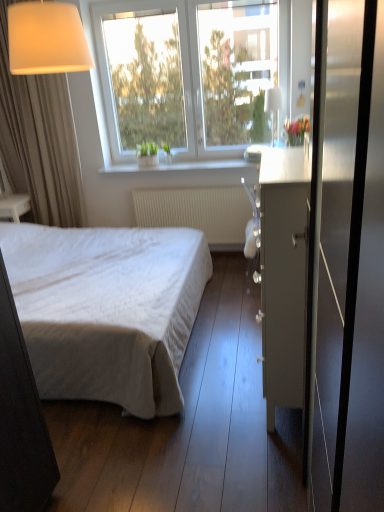
Question: In terms of height, does metallic glass screen door at right look taller or shorter compared to matte white lampshade at upper left, acting as the 1th lamp starting from the front?

Choices:
 (A) short
 (B) tall

Answer: (B)

Question: Considering the positions of metallic glass screen door at right and matte white lampshade at upper left, acting as the 1th lamp starting from the front, in the image, is metallic glass screen door at right wider or thinner than matte white lampshade at upper left, acting as the 1th lamp starting from the front,?

Choices:
 (A) wide
 (B) thin

Answer: (B)

Question: Based on their relative distances, which object is nearer to the matte gray cabinet at center-right?

Choices:
 (A) white textured radiator at center
 (B) transparent glass lamp at upper center, placed as the second lamp when sorted from front to back
 (C) white smooth window sill at upper center
 (D) transparent glass window at upper center
 (E) white quilted fabric bed at center

Answer: (E)

Question: Estimate the real-world distances between objects in this image. Which object is closer to the matte gray cabinet at center-right?

Choices:
 (A) transparent glass lamp at upper center, which ranks as the first lamp in back-to-front order
 (B) beige fabric curtain at left
 (C) matte white lampshade at upper left, acting as the 1th lamp starting from the front
 (D) white textured radiator at center
 (E) metallic glass screen door at right

Answer: (E)